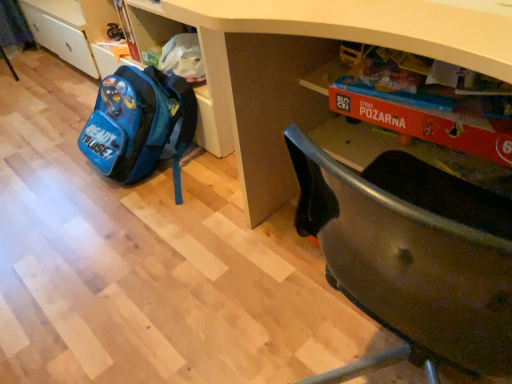
The height and width of the screenshot is (384, 512). Find the location of `free area in between white matte desk at center and blue fabric backpack at lower left`. free area in between white matte desk at center and blue fabric backpack at lower left is located at coordinates (218, 246).